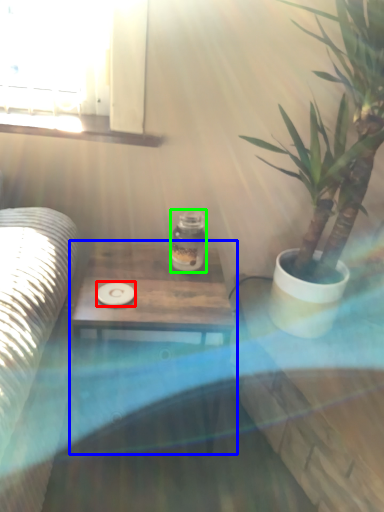
Question: Which is farther away from coaster (highlighted by a red box)? table (highlighted by a blue box) or glass jar (highlighted by a green box)?

Choices:
 (A) table
 (B) glass jar

Answer: (B)